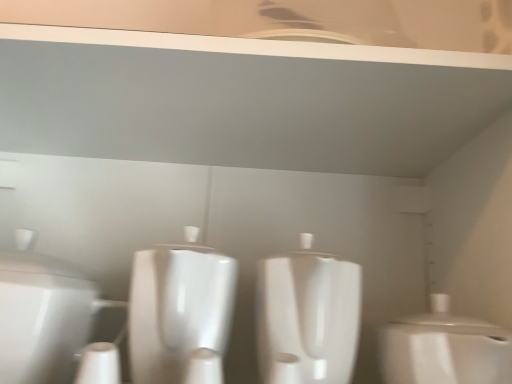
Question: From a real-world perspective, is white glossy toilet at left, the 1th toilet when ordered from left to right, physically below white glossy toilet at right, which is the third toilet from left to right?

Choices:
 (A) yes
 (B) no

Answer: (B)

Question: Are white glossy toilet at left, the 1th toilet when ordered from left to right, and white glossy toilet at right, which is the third toilet from left to right, located far from each other?

Choices:
 (A) no
 (B) yes

Answer: (A)

Question: Does white glossy toilet at left, the third toilet from the right, appear on the right side of white glossy toilet at right, which is the third toilet from left to right?

Choices:
 (A) yes
 (B) no

Answer: (B)

Question: Is white glossy toilet at right, which is the third toilet from left to right, at the back of white glossy toilet at left, the 1th toilet when ordered from left to right?

Choices:
 (A) no
 (B) yes

Answer: (A)

Question: Is white glossy toilet at left, the third toilet from the right, located outside white glossy toilet at right, which is the third toilet from left to right?

Choices:
 (A) no
 (B) yes

Answer: (B)

Question: From the image's perspective, does white glossy toilet at left, the 1th toilet when ordered from left to right, appear higher than white glossy toilet at right, which is the third toilet from left to right?

Choices:
 (A) no
 (B) yes

Answer: (B)

Question: Does white glossy toilet at right, which is the first toilet from right to left, have a smaller size compared to white glossy toilet at center, acting as the 2th toilet starting from the right?

Choices:
 (A) no
 (B) yes

Answer: (B)

Question: From a real-world perspective, does white glossy toilet at right, which is the third toilet from left to right, sit lower than white glossy toilet at center, acting as the 2th toilet starting from the right?

Choices:
 (A) yes
 (B) no

Answer: (A)

Question: Is white glossy toilet at right, which is the first toilet from right to left, thinner than white glossy toilet at center, acting as the 2th toilet starting from the right?

Choices:
 (A) no
 (B) yes

Answer: (B)

Question: Considering the relative sizes of white glossy toilet at right, which is the first toilet from right to left, and white glossy toilet at center, positioned as the second toilet in left-to-right order, in the image provided, is white glossy toilet at right, which is the first toilet from right to left, wider than white glossy toilet at center, positioned as the second toilet in left-to-right order,?

Choices:
 (A) no
 (B) yes

Answer: (A)

Question: Is white glossy toilet at right, which is the first toilet from right to left, taller than white glossy toilet at center, positioned as the second toilet in left-to-right order?

Choices:
 (A) no
 (B) yes

Answer: (A)

Question: Is white glossy toilet at right, which is the first toilet from right to left, closer to the viewer compared to white glossy toilet at center, positioned as the second toilet in left-to-right order?

Choices:
 (A) yes
 (B) no

Answer: (A)

Question: From a real-world perspective, is white glossy toilet at center, acting as the 2th toilet starting from the right, on top of white glossy toilet at right, which is the third toilet from left to right?

Choices:
 (A) no
 (B) yes

Answer: (B)